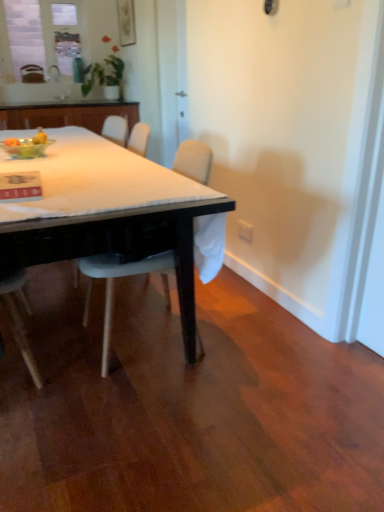
Question: Is transparent glass bottle at upper center wider than white glossy sink at upper center?

Choices:
 (A) no
 (B) yes

Answer: (A)

Question: Would you consider transparent glass bottle at upper center to be distant from white glossy sink at upper center?

Choices:
 (A) no
 (B) yes

Answer: (A)

Question: Would you say transparent glass bottle at upper center is outside white glossy sink at upper center?

Choices:
 (A) yes
 (B) no

Answer: (A)

Question: Does transparent glass bottle at upper center come in front of white glossy sink at upper center?

Choices:
 (A) yes
 (B) no

Answer: (B)

Question: Is the position of transparent glass bottle at upper center more distant than that of white glossy sink at upper center?

Choices:
 (A) no
 (B) yes

Answer: (B)

Question: Which is correct: white glossy sink at upper center is inside matte glass window at upper left, or outside of it?

Choices:
 (A) inside
 (B) outside

Answer: (B)

Question: From the image's perspective, is white glossy sink at upper center above or below matte glass window at upper left?

Choices:
 (A) below
 (B) above

Answer: (A)

Question: From a real-world perspective, is white glossy sink at upper center positioned above or below matte glass window at upper left?

Choices:
 (A) above
 (B) below

Answer: (B)

Question: Visually, is white glossy sink at upper center positioned to the left or to the right of matte glass window at upper left?

Choices:
 (A) left
 (B) right

Answer: (B)

Question: Relative to white plastic power outlet at lower right, is wooden cabinet at upper left in front or behind?

Choices:
 (A) front
 (B) behind

Answer: (B)

Question: From the image's perspective, relative to white plastic power outlet at lower right, is wooden cabinet at upper left above or below?

Choices:
 (A) above
 (B) below

Answer: (A)

Question: Is point (4, 117) positioned closer to the camera than point (248, 238)?

Choices:
 (A) farther
 (B) closer

Answer: (A)

Question: In the image, is wooden cabinet at upper left on the left side or the right side of white plastic power outlet at lower right?

Choices:
 (A) left
 (B) right

Answer: (A)

Question: Considering the positions of transparent glass bottle at upper center and matte glass window at upper left in the image, is transparent glass bottle at upper center bigger or smaller than matte glass window at upper left?

Choices:
 (A) small
 (B) big

Answer: (A)

Question: From a real-world perspective, is transparent glass bottle at upper center above or below matte glass window at upper left?

Choices:
 (A) below
 (B) above

Answer: (A)